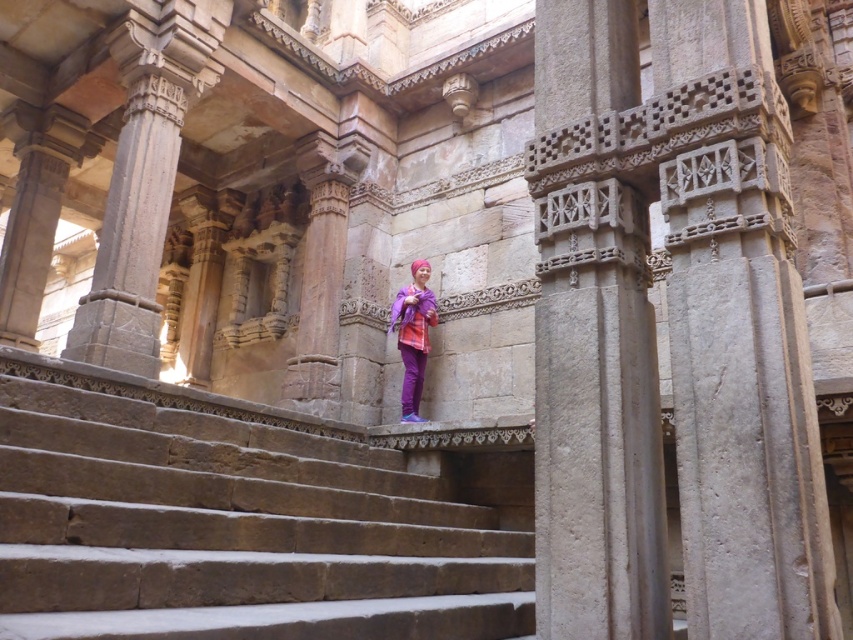
You are standing at the entrance of the temple and want to reach the brown stone stairs at center. According to the coordinates provided, in which direction should you move relative to your current position?

The brown stone stairs at center are located at coordinates point (233,529), so you should move forward and to the right relative to your current position at the entrance.